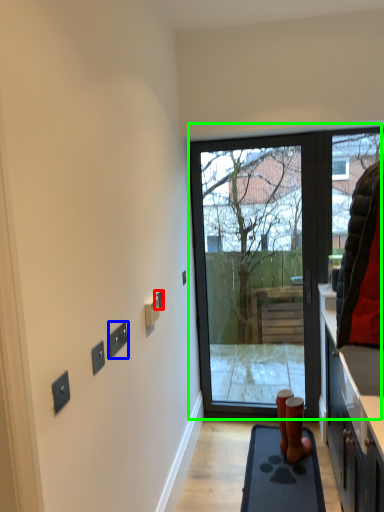
Question: Considering the real-world distances, which object is closest to electric outlet (highlighted by a red box)? electric outlet (highlighted by a blue box) or door (highlighted by a green box).

Choices:
 (A) electric outlet
 (B) door

Answer: (A)